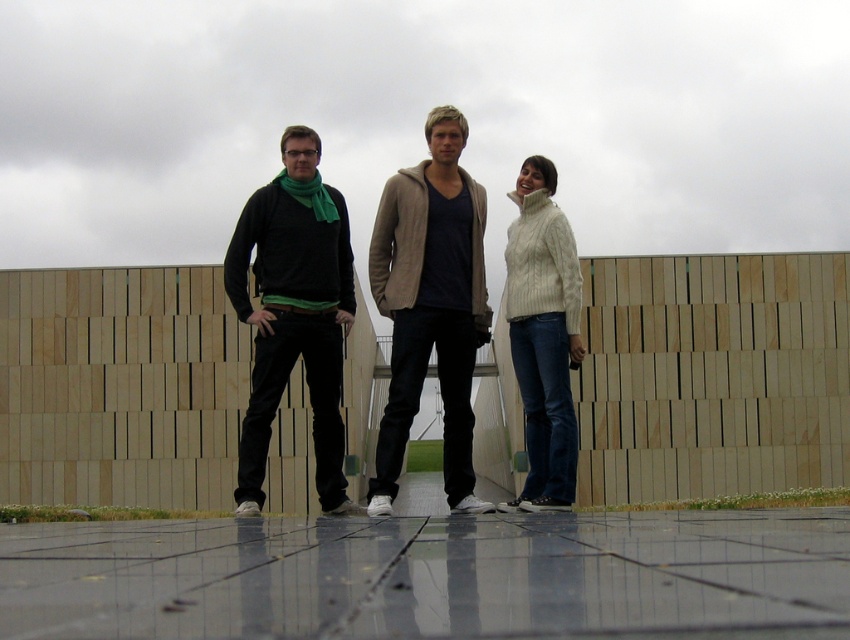
Question: Which of the following is the farthest from the observer?

Choices:
 (A) white cable-knit sweater at center
 (B) matte black pants at center
 (C) light brown knitted sweater at center
 (D) matte black sweater at center

Answer: (D)

Question: Where is matte black pants at center located in relation to matte black sweater at center in the image?

Choices:
 (A) right
 (B) left

Answer: (A)

Question: Is matte black pants at center behind light brown knitted sweater at center?

Choices:
 (A) yes
 (B) no

Answer: (A)

Question: Estimate the real-world distances between objects in this image. Which object is closer to the matte black sweater at center?

Choices:
 (A) white cable-knit sweater at center
 (B) light brown knitted sweater at center

Answer: (A)

Question: Can you confirm if matte black pants at center is wider than white cable-knit sweater at center?

Choices:
 (A) no
 (B) yes

Answer: (B)

Question: Which of the following is the farthest from the observer?

Choices:
 (A) (466, 500)
 (B) (428, 244)

Answer: (B)